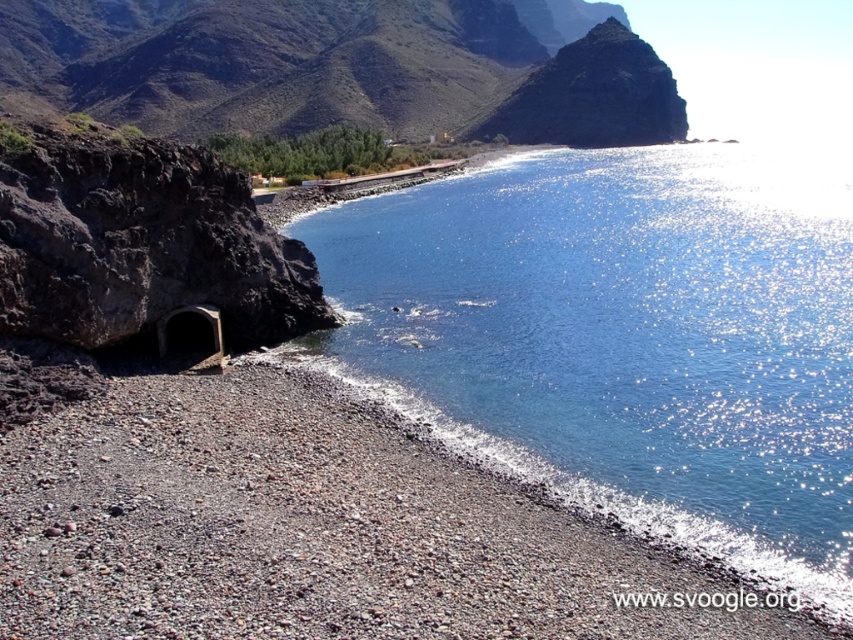
You are standing on the pebble beach and want to reach the blue glassy water at center. Based on the coordinates provided, in which direction should you walk from your current position to reach the water?

The blue glassy water at center is located at coordinates point (624, 337). Since you are on the pebble beach in the foreground, you should walk towards the center of the image where the water is positioned.